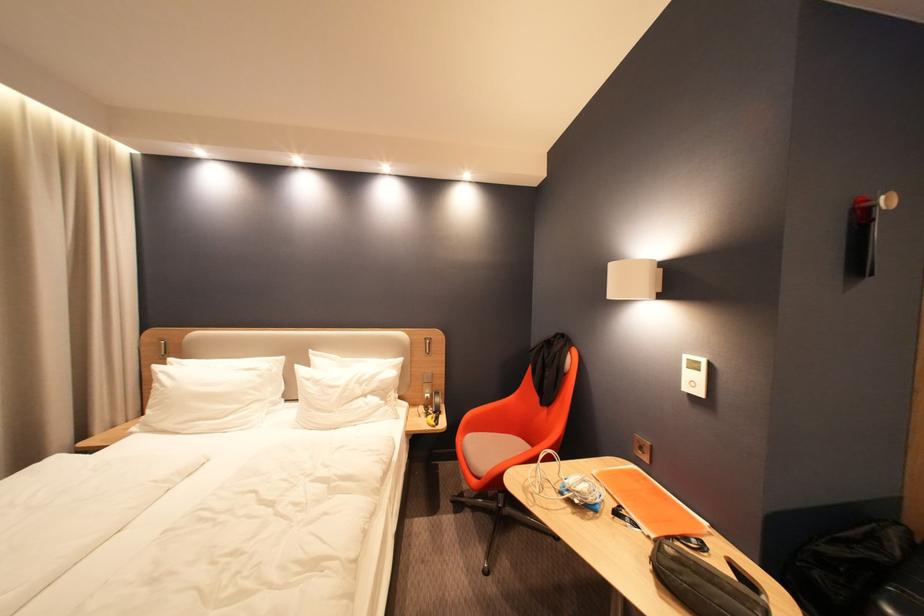
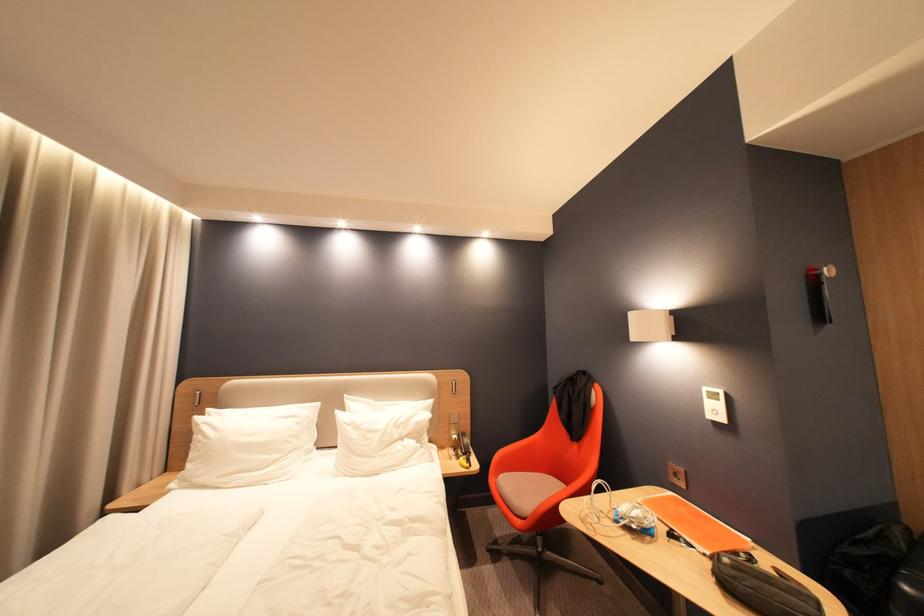
Where in the second image is the point corresponding to pixel 318 379 from the first image?

(359, 424)